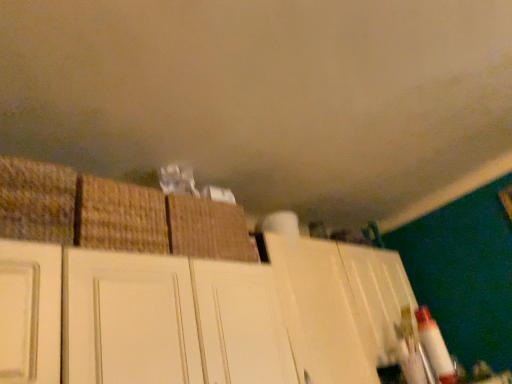
This screenshot has width=512, height=384. What do you see at coordinates (199, 315) in the screenshot? I see `white matte cabinet at upper center` at bounding box center [199, 315].

In order to face white matte cabinet at upper center, should I rotate leftwards or rightwards?

Turn right approximately 1.799 degrees to face it.

Identify the location of brown woven basket at center, positioned as the 3th basket in left-to-right order. The height and width of the screenshot is (384, 512). 208,229.

You are a GUI agent. You are given a task and a screenshot of the screen. Output one action in this format:
    pyautogui.click(x=<x>, y=<y>)
    Task: Click on the brown woven basket at center, the 2th basket viewed from the right
    
    Given the screenshot: What is the action you would take?
    pyautogui.click(x=120, y=216)

Which is in front, point (221, 204) or point (123, 212)?

The point (123, 212) is more forward.

Can you confirm if brown woven basket at center, positioned as the 3th basket in left-to-right order, is taller than brown woven basket at center, the second basket in the left-to-right sequence?

No, brown woven basket at center, positioned as the 3th basket in left-to-right order, is not taller than brown woven basket at center, the second basket in the left-to-right sequence.

Can you confirm if brown woven basket at center, the 1th basket positioned from the right, is positioned to the left of brown woven basket at center, the second basket in the left-to-right sequence?

Incorrect, brown woven basket at center, the 1th basket positioned from the right, is not on the left side of brown woven basket at center, the second basket in the left-to-right sequence.

Would you say brown woven basket at center, the 1th basket positioned from the right, is inside or outside brown woven basket at center, the 2th basket viewed from the right?

brown woven basket at center, the 1th basket positioned from the right, is spatially situated outside brown woven basket at center, the 2th basket viewed from the right.

Considering the sizes of white matte cabinet at upper center and woven straw basket at left, which is the 1th basket from left to right, in the image, is white matte cabinet at upper center wider or thinner than woven straw basket at left, which is the 1th basket from left to right,?

In the image, white matte cabinet at upper center appears to be wider than woven straw basket at left, which is the 1th basket from left to right.

Are white matte cabinet at upper center and woven straw basket at left, the third basket in the right-to-left sequence, beside each other?

There is a gap between white matte cabinet at upper center and woven straw basket at left, the third basket in the right-to-left sequence.

Is woven straw basket at left, the third basket in the right-to-left sequence, inside white matte cabinet at upper center?

That's correct, woven straw basket at left, the third basket in the right-to-left sequence, is inside white matte cabinet at upper center.

Does woven straw basket at left, the third basket in the right-to-left sequence, appear on the left side of brown woven basket at center, the 2th basket viewed from the right?

Correct, you'll find woven straw basket at left, the third basket in the right-to-left sequence, to the left of brown woven basket at center, the 2th basket viewed from the right.

From the woven straw basket at left, the third basket in the right-to-left sequence, count 1st baskets backward and point to it. Please provide its 2D coordinates.

[(120, 216)]

Does woven straw basket at left, the third basket in the right-to-left sequence, contain brown woven basket at center, the 2th basket viewed from the right?

No, brown woven basket at center, the 2th basket viewed from the right, is not surrounded by woven straw basket at left, the third basket in the right-to-left sequence.

Looking at their sizes, would you say woven straw basket at left, which is the 1th basket from left to right, is wider or thinner than brown woven basket at center, the second basket in the left-to-right sequence?

Clearly, woven straw basket at left, which is the 1th basket from left to right, has more width compared to brown woven basket at center, the second basket in the left-to-right sequence.

Is brown woven basket at center, the second basket in the left-to-right sequence, behind woven straw basket at left, the third basket in the right-to-left sequence?

Yes, the depth of brown woven basket at center, the second basket in the left-to-right sequence, is greater than that of woven straw basket at left, the third basket in the right-to-left sequence.

Identify the location of basket lying above the brown woven basket at center, the 2th basket viewed from the right (from the image's perspective). (37, 201).

Based on their sizes in the image, would you say brown woven basket at center, the second basket in the left-to-right sequence, is bigger or smaller than woven straw basket at left, which is the 1th basket from left to right?

Clearly, brown woven basket at center, the second basket in the left-to-right sequence, is larger in size than woven straw basket at left, which is the 1th basket from left to right.

Which is nearer, (229, 250) or (384, 275)?

The point (229, 250) is more forward.

Does brown woven basket at center, positioned as the 3th basket in left-to-right order, have a smaller size compared to white matte cabinet at upper center?

Indeed, brown woven basket at center, positioned as the 3th basket in left-to-right order, has a smaller size compared to white matte cabinet at upper center.

Which is more to the left, brown woven basket at center, positioned as the 3th basket in left-to-right order, or white matte cabinet at upper center?

brown woven basket at center, positioned as the 3th basket in left-to-right order, is more to the left.

Is brown woven basket at center, the 1th basket positioned from the right, placed right next to white matte cabinet at upper center?

No, brown woven basket at center, the 1th basket positioned from the right, is not in contact with white matte cabinet at upper center.

What's the angular difference between woven straw basket at left, which is the 1th basket from left to right, and brown woven basket at center, the 1th basket positioned from the right,'s facing directions?

The angular difference between woven straw basket at left, which is the 1th basket from left to right, and brown woven basket at center, the 1th basket positioned from the right, is 6.16 degrees.

From a real-world perspective, is woven straw basket at left, the third basket in the right-to-left sequence, over brown woven basket at center, the 1th basket positioned from the right?

Yes, from a real-world perspective, woven straw basket at left, the third basket in the right-to-left sequence, is on top of brown woven basket at center, the 1th basket positioned from the right.

Does point (41, 227) come closer to viewer compared to point (209, 208)?

That is True.

From the image's perspective, which one is positioned higher, white matte cabinet at upper center or brown woven basket at center, the second basket in the left-to-right sequence?

brown woven basket at center, the second basket in the left-to-right sequence, appears higher in the image.

Can you tell me how much white matte cabinet at upper center and brown woven basket at center, the 2th basket viewed from the right, differ in facing direction?

There is a 2.07-degree angle between the facing directions of white matte cabinet at upper center and brown woven basket at center, the 2th basket viewed from the right.

This screenshot has height=384, width=512. Identify the location of cabinetry on the right of brown woven basket at center, the 2th basket viewed from the right. (199, 315).

Considering the sizes of objects white matte cabinet at upper center and brown woven basket at center, the 2th basket viewed from the right, in the image provided, who is thinner, white matte cabinet at upper center or brown woven basket at center, the 2th basket viewed from the right,?

brown woven basket at center, the 2th basket viewed from the right, is thinner.

Find the location of a particular element. This screenshot has width=512, height=384. basket that is the 1st one above the brown woven basket at center, the 2th basket viewed from the right (from a real-world perspective) is located at coordinates (208, 229).

At what (x,y) coordinates should I click in order to perform the action: click on the 3rd basket above the white matte cabinet at upper center (from the image's perspective). Please return your answer as a coordinate pair (x, y). The width and height of the screenshot is (512, 384). Looking at the image, I should click on (37, 201).

Looking at the image, which one is located further to white matte cabinet at upper center, brown woven basket at center, the 1th basket positioned from the right, or woven straw basket at left, the third basket in the right-to-left sequence?

woven straw basket at left, the third basket in the right-to-left sequence.

Considering their positions, is brown woven basket at center, positioned as the 3th basket in left-to-right order, positioned closer to brown woven basket at center, the 2th basket viewed from the right, than woven straw basket at left, which is the 1th basket from left to right?

woven straw basket at left, which is the 1th basket from left to right, is positioned closer to the anchor brown woven basket at center, the 2th basket viewed from the right.

When comparing their distances from woven straw basket at left, which is the 1th basket from left to right, does brown woven basket at center, the 2th basket viewed from the right, or white matte cabinet at upper center seem closer?

brown woven basket at center, the 2th basket viewed from the right.

Consider the image. From the image, which object appears to be nearer to woven straw basket at left, which is the 1th basket from left to right, brown woven basket at center, the 1th basket positioned from the right, or brown woven basket at center, the second basket in the left-to-right sequence?

brown woven basket at center, the second basket in the left-to-right sequence, is positioned closer to the anchor woven straw basket at left, which is the 1th basket from left to right.

Which object lies further to the anchor point woven straw basket at left, the third basket in the right-to-left sequence, brown woven basket at center, the second basket in the left-to-right sequence, or brown woven basket at center, positioned as the 3th basket in left-to-right order?

Among the two, brown woven basket at center, positioned as the 3th basket in left-to-right order, is located further to woven straw basket at left, the third basket in the right-to-left sequence.

Estimate the real-world distances between objects in this image. Which object is further from woven straw basket at left, which is the 1th basket from left to right, white matte cabinet at upper center or brown woven basket at center, positioned as the 3th basket in left-to-right order?

white matte cabinet at upper center is further to woven straw basket at left, which is the 1th basket from left to right.

Looking at the image, which one is located closer to brown woven basket at center, the 1th basket positioned from the right, woven straw basket at left, which is the 1th basket from left to right, or brown woven basket at center, the second basket in the left-to-right sequence?

brown woven basket at center, the second basket in the left-to-right sequence, lies closer to brown woven basket at center, the 1th basket positioned from the right, than the other object.

Based on their spatial positions, is woven straw basket at left, which is the 1th basket from left to right, or brown woven basket at center, the 1th basket positioned from the right, closer to brown woven basket at center, the second basket in the left-to-right sequence?

The object closer to brown woven basket at center, the second basket in the left-to-right sequence, is woven straw basket at left, which is the 1th basket from left to right.

This screenshot has width=512, height=384. Find the location of `basket between woven straw basket at left, which is the 1th basket from left to right, and brown woven basket at center, positioned as the 3th basket in left-to-right order, from left to right`. basket between woven straw basket at left, which is the 1th basket from left to right, and brown woven basket at center, positioned as the 3th basket in left-to-right order, from left to right is located at coordinates (120, 216).